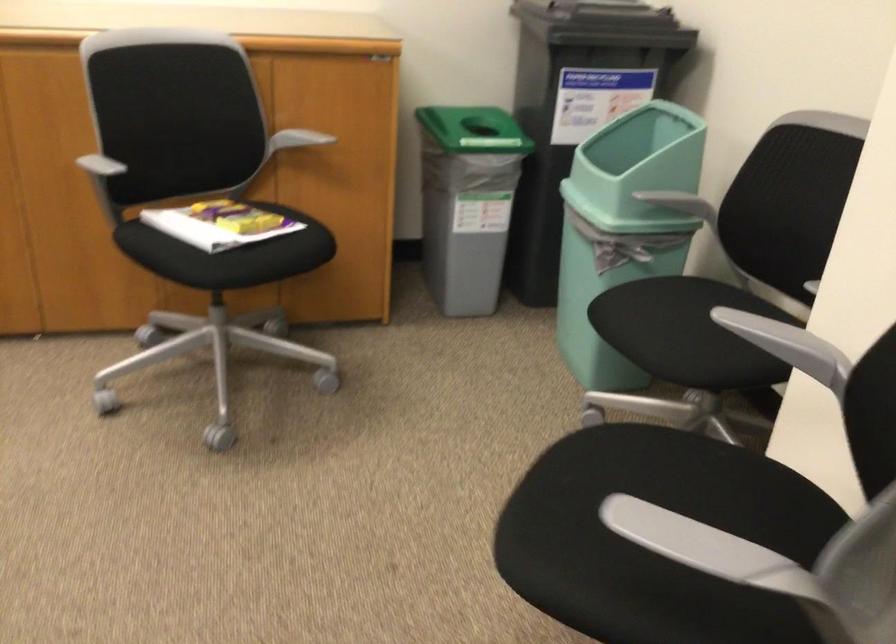
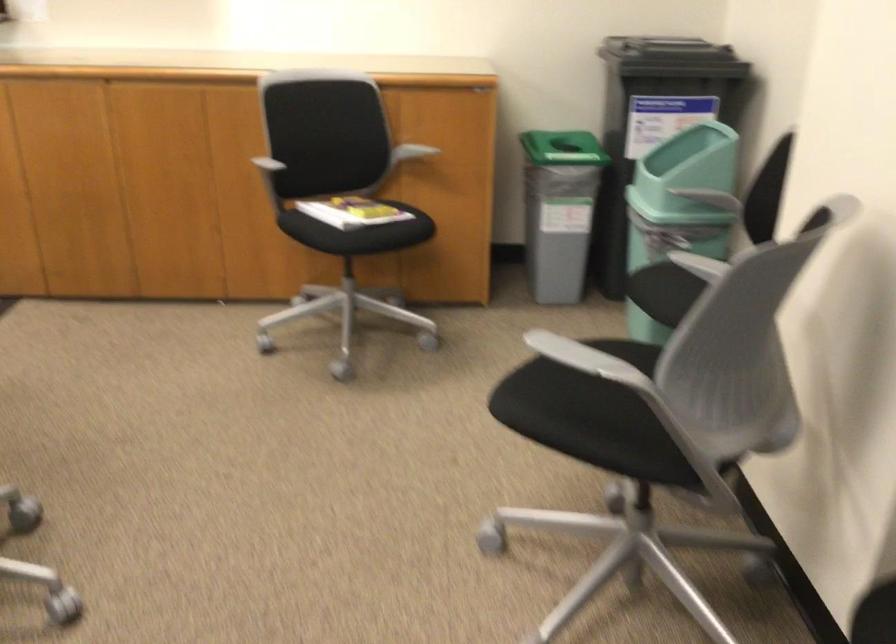
Where in the second image is the point corresponding to (x=716, y=541) from the first image?

(583, 357)